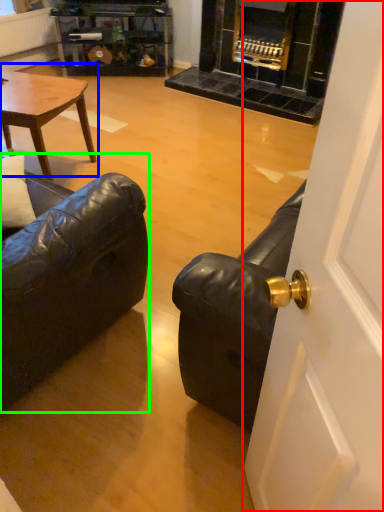
Question: Considering the real-world distances, which object is farthest from door (highlighted by a red box)? coffee table (highlighted by a blue box) or studio couch (highlighted by a green box)?

Choices:
 (A) coffee table
 (B) studio couch

Answer: (A)